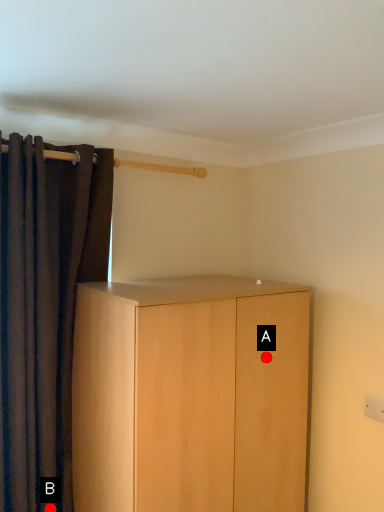
Question: Two points are circled on the image, labeled by A and B beside each circle. Which point is farther to the camera?

Choices:
 (A) A is further
 (B) B is further

Answer: (B)